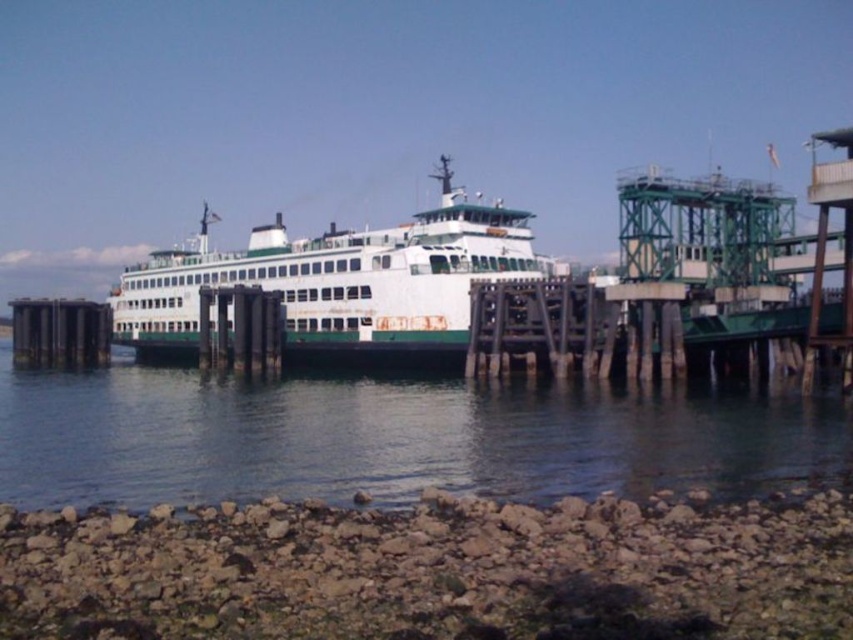
You are standing on the pier and looking at the clear water at center and the white matte ferry at center. Which object is lower in height?

The clear water at center has a lesser height compared to the white matte ferry at center, so the clear water at center is lower in height.

You are standing on the pier and looking at the clear water at center and the white matte ferry at center. Which object is positioned lower in the scene?

The clear water at center is located below the white matte ferry at center, so it is positioned lower in the scene.

You are standing on the pier and want to check the water level. Where exactly is the clear water at center located in the image?

The clear water at center is located at point coordinates of 0.686 on the x axis and 0.463 on the y axis.